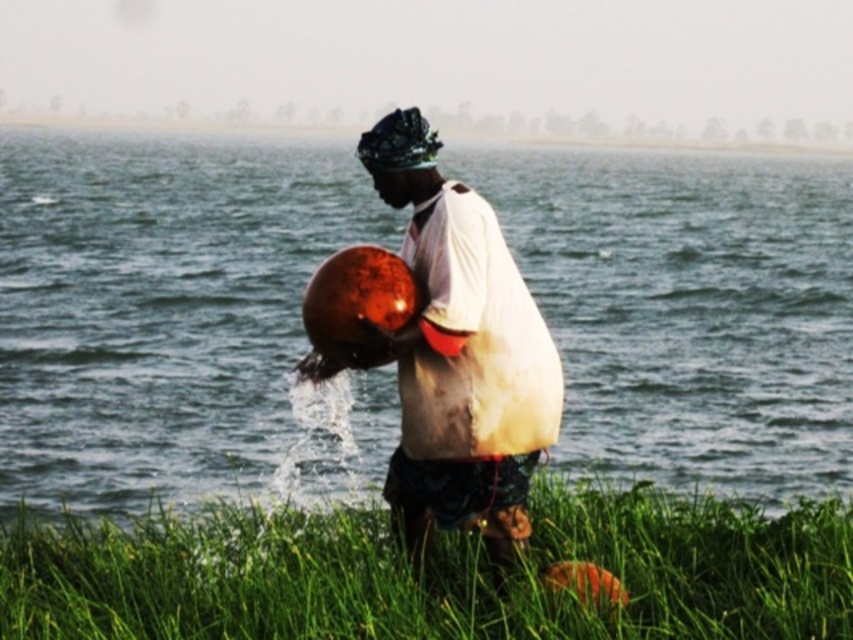
Consider the image. Does glossy metallic water at center have a lesser height compared to shiny metallic pot at center?

No, glossy metallic water at center is not shorter than shiny metallic pot at center.

Is point (30, 348) in front of point (428, 179)?

No, it is behind (428, 179).

I want to click on glossy metallic water at center, so click(177, 317).

Which is more to the left, glossy metallic water at center or green grass at lower center?

green grass at lower center

Describe the element at coordinates (177, 317) in the screenshot. I see `glossy metallic water at center` at that location.

Where is `glossy metallic water at center`? This screenshot has width=853, height=640. glossy metallic water at center is located at coordinates (177, 317).

Is point (538, 632) closer to viewer compared to point (480, 419)?

Yes, it is.

Is green grass at lower center smaller than shiny metallic pot at center?

No, green grass at lower center is not smaller than shiny metallic pot at center.

Where is `green grass at lower center`? green grass at lower center is located at coordinates (432, 572).

Find the location of a particular element. green grass at lower center is located at coordinates (432, 572).